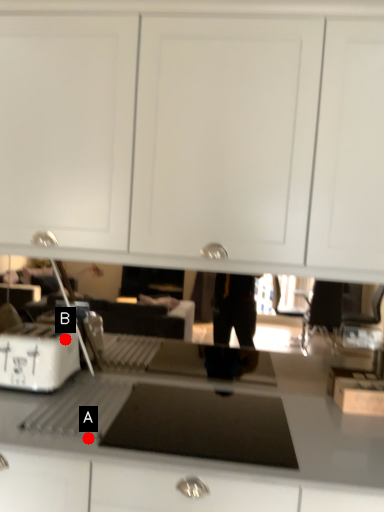
Question: Two points are circled on the image, labeled by A and B beside each circle. Which point is farther to the camera?

Choices:
 (A) A is further
 (B) B is further

Answer: (B)